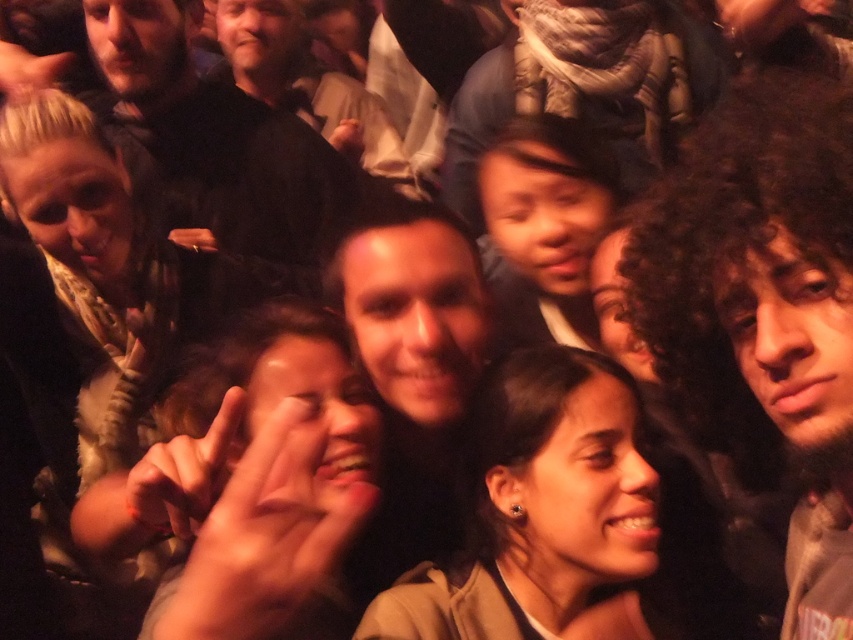
You are a photographer trying to focus on the point at coordinates (181, 476) in the image. According to the scene description, what object is located at that point?

The point at coordinates (181, 476) is on a smooth skin hand at center.

In the image, there is a point labeled as point (28, 68). Based on the scene description provided, can you identify what this point might represent?

The point (28, 68) corresponds to the smooth skin hand at upper left.

You are at a social gathering and notice two hands in the photo. One is the smooth skin hand at center and the other is the smooth skin hand at upper left. From your perspective, which hand is to the right of the other?

The smooth skin hand at center is positioned on the right side of the smooth skin hand at upper left.